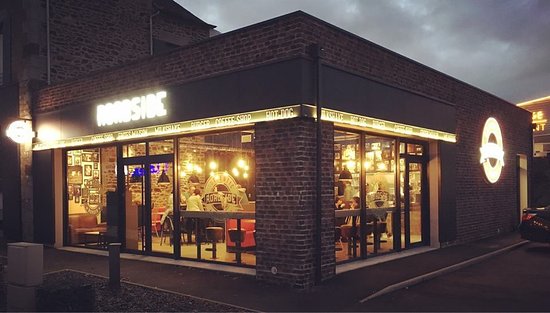
The width and height of the screenshot is (550, 313). I want to click on place to sit, so click(213, 232), click(236, 234), click(346, 227), click(370, 225), click(382, 223), click(87, 225).